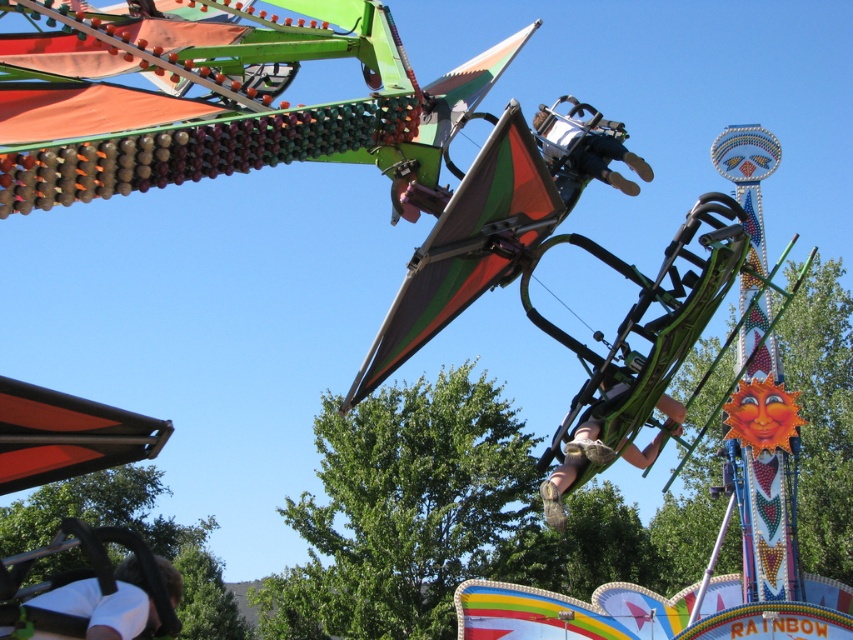
What do you see at coordinates (602, 449) in the screenshot? I see `green fabric seat at center` at bounding box center [602, 449].

Does green fabric seat at center lie behind matte black helmet at center?

No, green fabric seat at center is in front of matte black helmet at center.

Where is `green fabric seat at center`? green fabric seat at center is located at coordinates (602, 449).

At what (x,y) coordinates should I click in order to perform the action: click on green fabric seat at center. Please return your answer as a coordinate pair (x, y). Image resolution: width=853 pixels, height=640 pixels. Looking at the image, I should click on (602, 449).

Does white matte shirt at lower left come in front of green fabric seat at center?

Yes, it is in front of green fabric seat at center.

Does white matte shirt at lower left have a lesser width compared to green fabric seat at center?

Yes.

Find the location of `white matte shirt at lower left`. white matte shirt at lower left is located at coordinates (106, 604).

Is white matte shirt at lower left positioned behind matte black helmet at center?

No.

Can you confirm if white matte shirt at lower left is taller than matte black helmet at center?

Incorrect, white matte shirt at lower left's height is not larger of matte black helmet at center's.

Where is `white matte shirt at lower left`? Image resolution: width=853 pixels, height=640 pixels. white matte shirt at lower left is located at coordinates (106, 604).